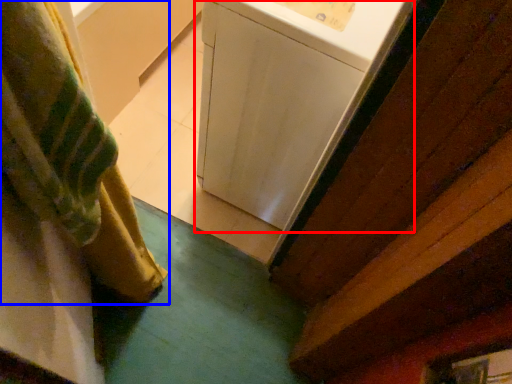
Question: Which of the following is the closest to the observer, washing machine (highlighted by a red box) or curtain (highlighted by a blue box)?

Choices:
 (A) washing machine
 (B) curtain

Answer: (B)